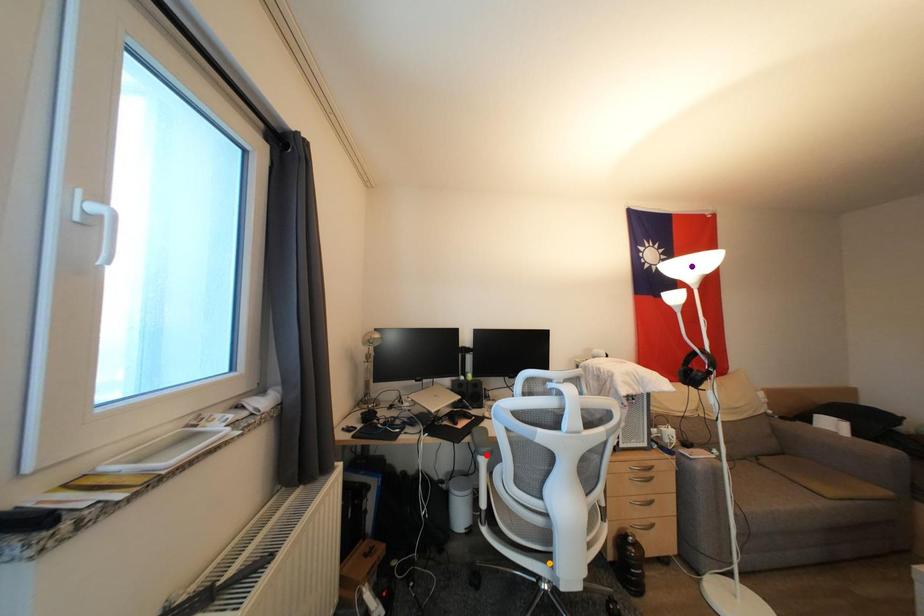
Looking at this image, order these from nearest to farthest:
1. orange point
2. purple point
3. red point

orange point, red point, purple point